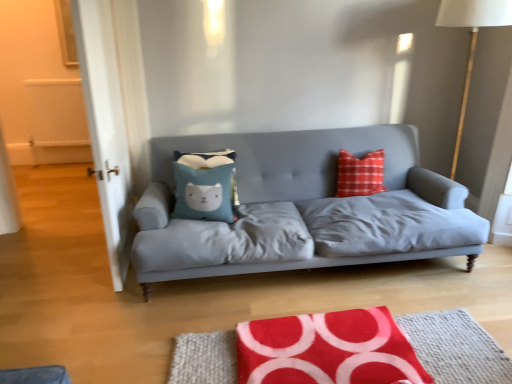
In order to face red fabric rug at lower center, should I rotate leftwards or rightwards?

To align with it, rotate right about 11.028°.

Find the location of a particular element. The height and width of the screenshot is (384, 512). transparent glass door at left is located at coordinates click(x=108, y=119).

Can you tell me how much red fabric rug at lower center and matte gray fabric couch at center differ in facing direction?

There is a 178-degree angle between the facing directions of red fabric rug at lower center and matte gray fabric couch at center.

Is red fabric rug at lower center spatially inside matte gray fabric couch at center, or outside of it?

The correct answer is: outside.

In terms of size, does red fabric rug at lower center appear bigger or smaller than matte gray fabric couch at center?

red fabric rug at lower center is smaller than matte gray fabric couch at center.

Which object is further away from the camera, red fabric rug at lower center or matte gray fabric couch at center?

Positioned behind is matte gray fabric couch at center.

In terms of width, does matte gray fabric couch at center look wider or thinner when compared to blue fabric pillow at center?

In the image, matte gray fabric couch at center appears to be wider than blue fabric pillow at center.

Is blue fabric pillow at center at the back of matte gray fabric couch at center?

Yes, blue fabric pillow at center is at the back of matte gray fabric couch at center.

From the image's perspective, is matte gray fabric couch at center located beneath blue fabric pillow at center?

Correct, matte gray fabric couch at center appears lower than blue fabric pillow at center in the image.

Considering the sizes of objects matte gray fabric couch at center and blue fabric pillow at center in the image provided, who is taller, matte gray fabric couch at center or blue fabric pillow at center?

matte gray fabric couch at center is taller.

Consider the image. Between matte gray fabric couch at center and red fabric rug at lower center, which one has less height?

With less height is red fabric rug at lower center.

Between matte gray fabric couch at center and red fabric rug at lower center, which one appears on the left side from the viewer's perspective?

matte gray fabric couch at center is more to the left.

Is matte gray fabric couch at center next to red fabric rug at lower center?

No, matte gray fabric couch at center is not next to red fabric rug at lower center.

How much distance is there between matte gray fabric couch at center and red fabric rug at lower center?

3.51 feet.

In the scene shown: Is transparent glass door at left aimed at white fabric lampshade at right?

No, transparent glass door at left is not turned towards white fabric lampshade at right.

Between transparent glass door at left and white fabric lampshade at right, which one has smaller size?

transparent glass door at left.

Visually, is transparent glass door at left positioned to the left or to the right of white fabric lampshade at right?

Clearly, transparent glass door at left is on the left of white fabric lampshade at right in the image.

Looking at their sizes, would you say transparent glass door at left is wider or thinner than white fabric lampshade at right?

In the image, transparent glass door at left appears to be more narrow than white fabric lampshade at right.

Looking at the image, does blue fabric pillow at center seem bigger or smaller compared to white fabric lampshade at right?

Considering their sizes, blue fabric pillow at center takes up less space than white fabric lampshade at right.

From the image's perspective, would you say blue fabric pillow at center is shown under white fabric lampshade at right?

Yes.

Which of these two, blue fabric pillow at center or white fabric lampshade at right, stands shorter?

blue fabric pillow at center is shorter.

Does point (85, 44) appear closer or farther from the camera than point (255, 255)?

Point (85, 44) is positioned farther from the camera compared to point (255, 255).

Which is in front, transparent glass door at left or matte gray fabric couch at center?

transparent glass door at left is closer to the camera.

Measure the distance from transparent glass door at left to matte gray fabric couch at center.

transparent glass door at left and matte gray fabric couch at center are 37.48 inches apart.

Is transparent glass door at left looking in the opposite direction of matte gray fabric couch at center?

Yes, transparent glass door at left is positioned with its back facing matte gray fabric couch at center.

Does transparent glass door at left have a greater width compared to red fabric rug at lower center?

No, transparent glass door at left is not wider than red fabric rug at lower center.

I want to click on mat lying below the transparent glass door at left (from the image's perspective), so click(x=455, y=348).

Can you tell me how much transparent glass door at left and red fabric rug at lower center differ in facing direction?

transparent glass door at left and red fabric rug at lower center are facing 91.1 degrees away from each other.

Is transparent glass door at left smaller than red fabric rug at lower center?

Incorrect, transparent glass door at left is not smaller in size than red fabric rug at lower center.

Image resolution: width=512 pixels, height=384 pixels. What are the coordinates of `mat located below the matte gray fabric couch at center (from the image's perspective)` in the screenshot? It's located at (455, 348).

Locate an element on the screen. pillow located on the left of matte gray fabric couch at center is located at coordinates (204, 192).

Considering their positions, is blue fabric pillow at center positioned closer to transparent glass door at left than matte gray fabric couch at center?

blue fabric pillow at center is closer to transparent glass door at left.

From the image, which object appears to be farther from transparent glass door at left, matte gray fabric couch at center or white fabric lampshade at right?

white fabric lampshade at right is further to transparent glass door at left.

From the image, which object appears to be nearer to white fabric lampshade at right, matte gray fabric couch at center or transparent glass door at left?

matte gray fabric couch at center is closer to white fabric lampshade at right.

Which object lies nearer to the anchor point white fabric lampshade at right, red fabric rug at lower center or blue fabric pillow at center?

The object closer to white fabric lampshade at right is red fabric rug at lower center.

From the image, which object appears to be nearer to matte gray fabric couch at center, blue fabric pillow at center or red fabric rug at lower center?

Based on the image, blue fabric pillow at center appears to be nearer to matte gray fabric couch at center.

Which object lies nearer to the anchor point blue fabric pillow at center, white fabric lampshade at right or matte gray fabric couch at center?

Among the two, matte gray fabric couch at center is located nearer to blue fabric pillow at center.

Consider the image. Estimate the real-world distances between objects in this image. Which object is further from blue fabric pillow at center, white fabric lampshade at right or transparent glass door at left?

white fabric lampshade at right lies further to blue fabric pillow at center than the other object.

From the image, which object appears to be nearer to red fabric rug at lower center, blue fabric pillow at center or white fabric lampshade at right?

Among the two, blue fabric pillow at center is located nearer to red fabric rug at lower center.

I want to click on studio couch that lies between white fabric lampshade at right and red fabric rug at lower center from top to bottom, so click(x=302, y=207).

Locate an element on the screen. mat between blue fabric pillow at center and white fabric lampshade at right from left to right is located at coordinates (455, 348).

Where is `studio couch between blue fabric pillow at center and red fabric rug at lower center in the up-down direction`? studio couch between blue fabric pillow at center and red fabric rug at lower center in the up-down direction is located at coordinates (302, 207).

Identify the location of pillow between transparent glass door at left and matte gray fabric couch at center from left to right. (204, 192).